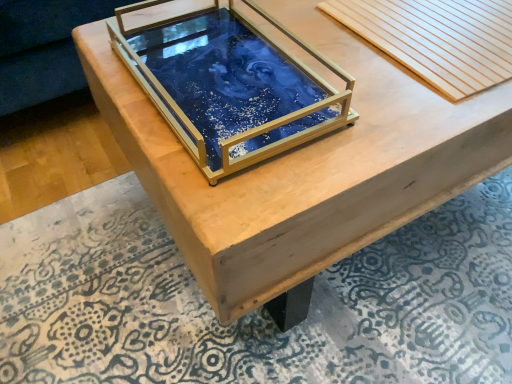
Question: Is blue resin tray at center at the back of blue resin tray at center?

Choices:
 (A) no
 (B) yes

Answer: (A)

Question: Is blue resin tray at center at the left side of blue resin tray at center?

Choices:
 (A) yes
 (B) no

Answer: (B)

Question: From a real-world perspective, is blue resin tray at center located beneath blue resin tray at center?

Choices:
 (A) no
 (B) yes

Answer: (B)

Question: Is blue resin tray at center positioned beyond the bounds of blue resin tray at center?

Choices:
 (A) yes
 (B) no

Answer: (A)

Question: Considering the relative sizes of blue resin tray at center and blue resin tray at center in the image provided, is blue resin tray at center bigger than blue resin tray at center?

Choices:
 (A) no
 (B) yes

Answer: (B)

Question: Is blue resin tray at center bigger or smaller than wooden slats at upper right?

Choices:
 (A) big
 (B) small

Answer: (A)

Question: Considering the relative positions of blue resin tray at center and wooden slats at upper right in the image provided, is blue resin tray at center to the left or to the right of wooden slats at upper right?

Choices:
 (A) right
 (B) left

Answer: (B)

Question: Relative to wooden slats at upper right, is blue resin tray at center in front or behind?

Choices:
 (A) front
 (B) behind

Answer: (A)

Question: Considering the positions of blue resin tray at center and wooden slats at upper right in the image, is blue resin tray at center taller or shorter than wooden slats at upper right?

Choices:
 (A) tall
 (B) short

Answer: (B)

Question: Looking at the image, does blue resin tray at center seem bigger or smaller compared to wooden slats at upper right?

Choices:
 (A) big
 (B) small

Answer: (B)

Question: Does point (219, 14) appear closer or farther from the camera than point (480, 39)?

Choices:
 (A) farther
 (B) closer

Answer: (A)

Question: Considering the positions of blue resin tray at center and wooden slats at upper right in the image, is blue resin tray at center taller or shorter than wooden slats at upper right?

Choices:
 (A) tall
 (B) short

Answer: (A)

Question: Choose the correct answer: Is blue resin tray at center inside wooden slats at upper right or outside it?

Choices:
 (A) outside
 (B) inside

Answer: (A)

Question: Is point (373, 21) positioned closer to the camera than point (168, 33)?

Choices:
 (A) farther
 (B) closer

Answer: (A)

Question: Relative to blue resin tray at center, is wooden slats at upper right in front or behind?

Choices:
 (A) front
 (B) behind

Answer: (B)